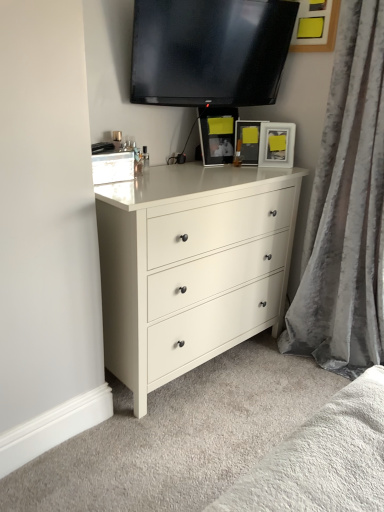
Question: Can matte white dresser at center be found inside matte black picture frame at upper right, marked as the 3th picture frame in a left-to-right arrangement?

Choices:
 (A) no
 (B) yes

Answer: (A)

Question: Would you say matte black picture frame at upper right, marked as the 3th picture frame in a left-to-right arrangement, is outside matte white dresser at center?

Choices:
 (A) yes
 (B) no

Answer: (A)

Question: Does matte black picture frame at upper right, marked as the 3th picture frame in a left-to-right arrangement, appear on the left side of matte white dresser at center?

Choices:
 (A) yes
 (B) no

Answer: (B)

Question: Is matte black picture frame at upper right, the 1th picture frame viewed from the right, taller than matte white dresser at center?

Choices:
 (A) yes
 (B) no

Answer: (B)

Question: Is matte black picture frame at upper right, the 1th picture frame viewed from the right, shorter than matte white dresser at center?

Choices:
 (A) yes
 (B) no

Answer: (A)

Question: Is matte black picture frame at upper center, which ranks as the 3th picture frame in right-to-left order, situated inside black glossy tv at upper center or outside?

Choices:
 (A) inside
 (B) outside

Answer: (B)

Question: In terms of size, does matte black picture frame at upper center, marked as the first picture frame in a left-to-right arrangement, appear bigger or smaller than black glossy tv at upper center?

Choices:
 (A) big
 (B) small

Answer: (B)

Question: Does point (226, 117) appear closer or farther from the camera than point (201, 78)?

Choices:
 (A) closer
 (B) farther

Answer: (B)

Question: From a real-world perspective, is matte black picture frame at upper center, which ranks as the 3th picture frame in right-to-left order, physically located above or below black glossy tv at upper center?

Choices:
 (A) above
 (B) below

Answer: (B)

Question: Is matte black picture frame at upper center, which ranks as the 3th picture frame in right-to-left order, situated inside velvet gray curtain at right or outside?

Choices:
 (A) outside
 (B) inside

Answer: (A)

Question: Is point (221, 161) positioned closer to the camera than point (319, 242)?

Choices:
 (A) closer
 (B) farther

Answer: (B)

Question: From the image's perspective, relative to velvet gray curtain at right, is matte black picture frame at upper center, which ranks as the 3th picture frame in right-to-left order, above or below?

Choices:
 (A) above
 (B) below

Answer: (A)

Question: In the image, is matte black picture frame at upper center, which ranks as the 3th picture frame in right-to-left order, positioned in front of or behind velvet gray curtain at right?

Choices:
 (A) front
 (B) behind

Answer: (B)

Question: From a real-world perspective, is matte white dresser at center above or below matte black picture frame at center, which is the second picture frame from left to right?

Choices:
 (A) above
 (B) below

Answer: (B)

Question: Considering the positions of matte white dresser at center and matte black picture frame at center, the second picture frame in the right-to-left sequence, in the image, is matte white dresser at center taller or shorter than matte black picture frame at center, the second picture frame in the right-to-left sequence,?

Choices:
 (A) tall
 (B) short

Answer: (A)